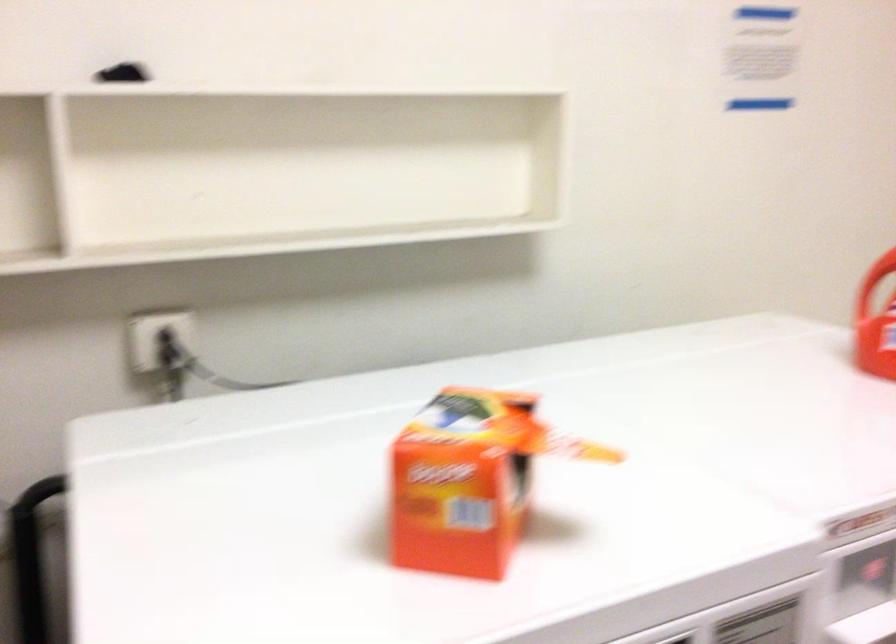
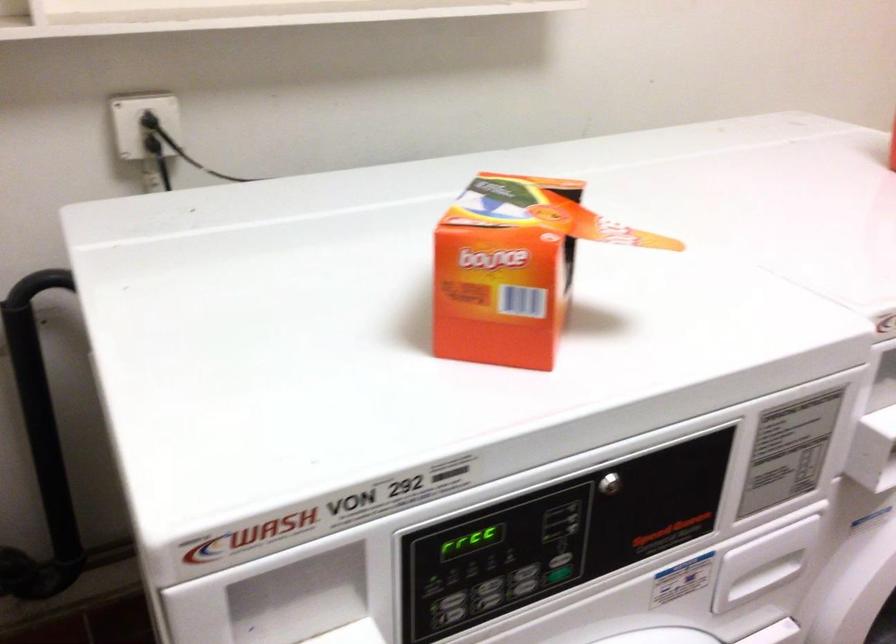
Locate, in the second image, the point that corresponds to (x=451, y=503) in the first image.

(502, 287)